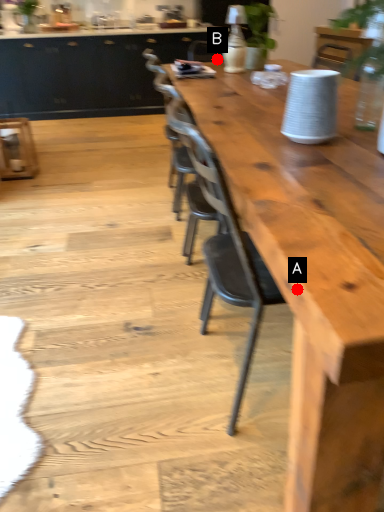
Question: Two points are circled on the image, labeled by A and B beside each circle. Which point is closer to the camera?

Choices:
 (A) A is closer
 (B) B is closer

Answer: (A)